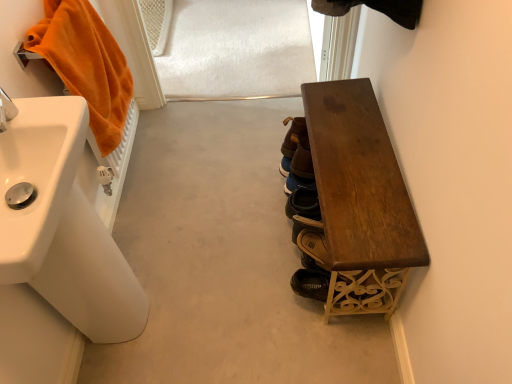
At what (x,y) coordinates should I click in order to perform the action: click on vacant space behind white glossy sink at left, acting as the 2th sink starting from the front. Please return your answer as a coordinate pair (x, y). Image resolution: width=512 pixels, height=384 pixels. Looking at the image, I should click on (149, 256).